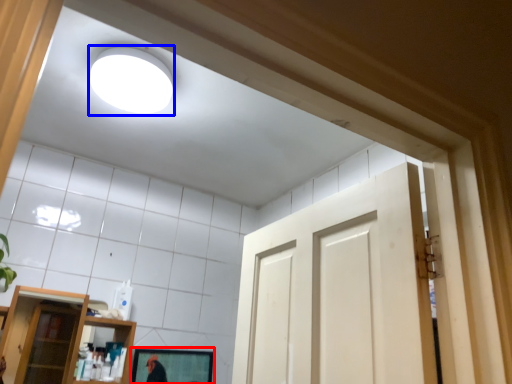
Question: Among these objects, which one is farthest to the camera, mirror (highlighted by a red box) or lighting (highlighted by a blue box)?

Choices:
 (A) mirror
 (B) lighting

Answer: (A)